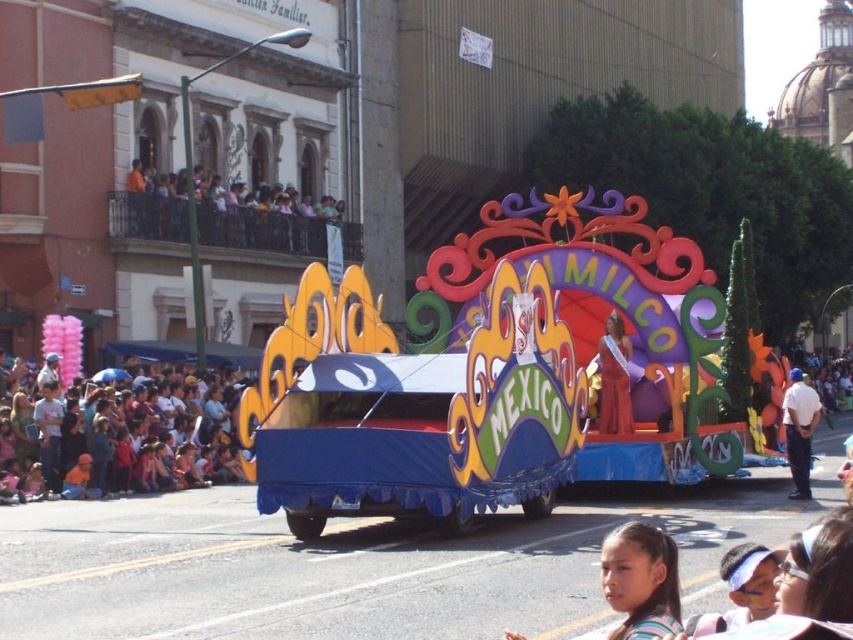
Does matte white children at lower left have a lesser width compared to matte gold sash at center?

Incorrect, matte white children at lower left's width is not less than matte gold sash at center's.

Between matte white children at lower left and matte gold sash at center, which one is positioned higher?

matte gold sash at center is above.

What do you see at coordinates (105, 433) in the screenshot? I see `matte white children at lower left` at bounding box center [105, 433].

Where is `matte white children at lower left`? matte white children at lower left is located at coordinates (105, 433).

Which is in front, point (605, 358) or point (805, 436)?

Point (805, 436) is more forward.

Is matte gold sash at center positioned in front of white uniform at center?

No, it is behind white uniform at center.

Who is more distant from viewer, (611, 323) or (801, 410)?

The point (611, 323) is behind.

I want to click on matte gold sash at center, so 614,378.

Does point (9, 472) come farther from viewer compared to point (790, 440)?

Yes, point (9, 472) is farther from viewer.

Can you confirm if matte white children at lower left is positioned below white uniform at center?

Actually, matte white children at lower left is above white uniform at center.

Between point (39, 460) and point (782, 400), which one is positioned behind?

Point (39, 460)

I want to click on matte white children at lower left, so click(x=105, y=433).